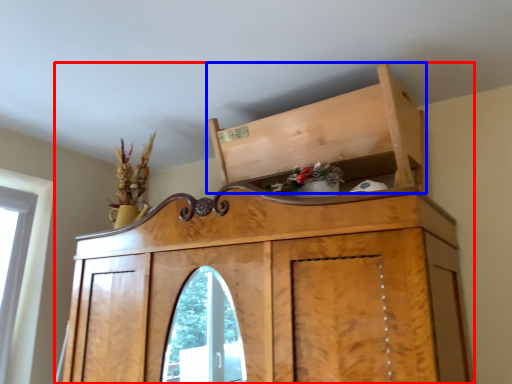
Question: Among these objects, which one is farthest to the camera, furniture (highlighted by a red box) or cabinetry (highlighted by a blue box)?

Choices:
 (A) furniture
 (B) cabinetry

Answer: (B)